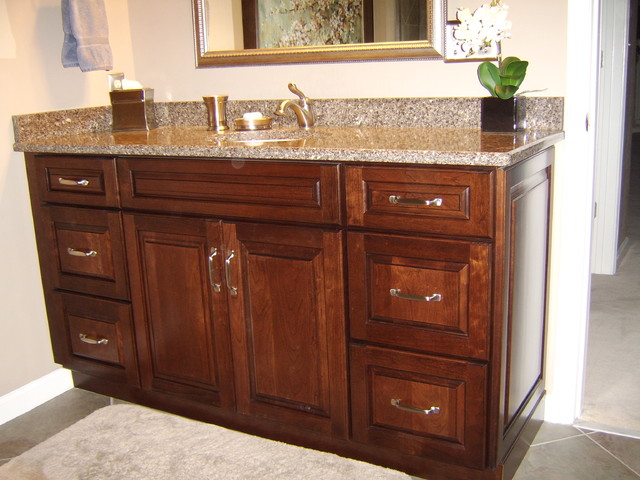
You are a GUI agent. You are given a task and a screenshot of the screen. Output one action in this format:
    pyautogui.click(x=<x>, y=<y>)
    Task: Click on the countertop
    
    Given the screenshot: What is the action you would take?
    pyautogui.click(x=396, y=136)